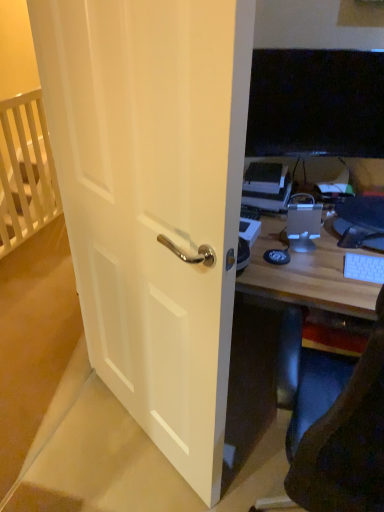
Locate an element on the screen. Image resolution: width=384 pixels, height=512 pixels. free space that is to the left of white matte door at center is located at coordinates (94, 438).